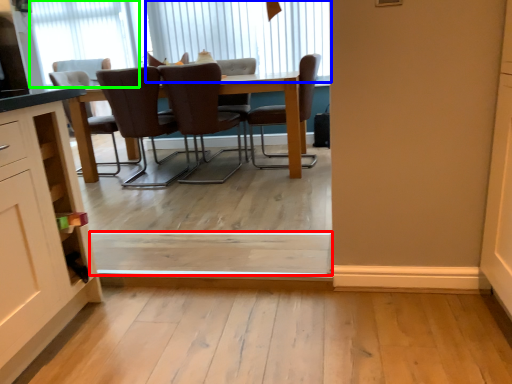
Question: Estimate the real-world distances between objects in this image. Which object is closer to plank (highlighted by a red box), window (highlighted by a blue box) or window (highlighted by a green box)?

Choices:
 (A) window
 (B) window

Answer: (A)